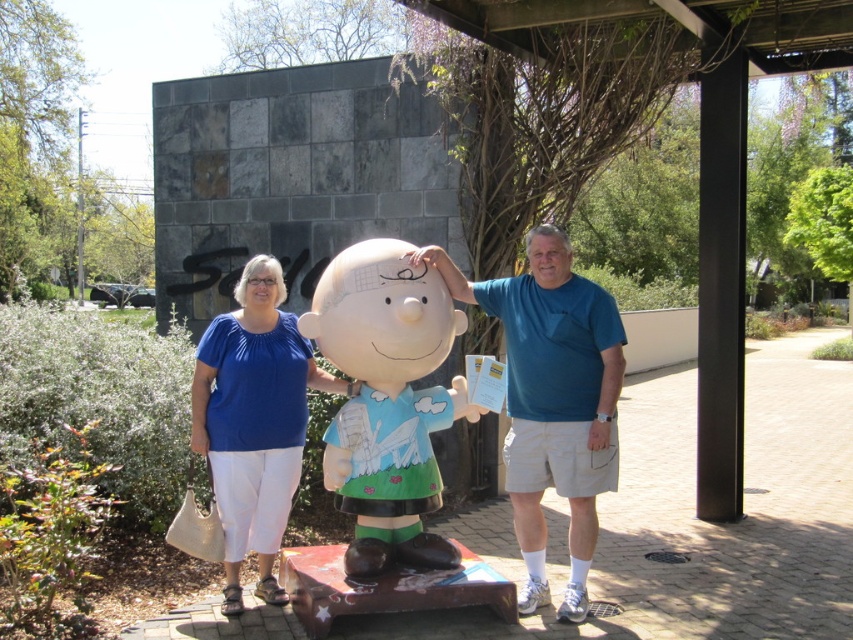
Question: Can you confirm if matte blue shirt at center is positioned above blue cotton shirt at center?

Choices:
 (A) yes
 (B) no

Answer: (A)

Question: Can you confirm if matte blue shirt at center is positioned above smooth plastic statue at center?

Choices:
 (A) yes
 (B) no

Answer: (B)

Question: Among these objects, which one is nearest to the camera?

Choices:
 (A) blue cotton shirt at center
 (B) matte blue blouse at center

Answer: (A)

Question: Which object appears closest to the camera in this image?

Choices:
 (A) smooth plastic statue at center
 (B) matte blue shirt at center
 (C) blue cotton shirt at center
 (D) matte blue blouse at center

Answer: (A)

Question: Does smooth plastic statue at center have a greater width compared to blue cotton shirt at center?

Choices:
 (A) no
 (B) yes

Answer: (A)

Question: Which point is closer to the camera?

Choices:
 (A) matte blue blouse at center
 (B) blue cotton shirt at center
 (C) matte blue shirt at center
 (D) smooth plastic statue at center

Answer: (D)